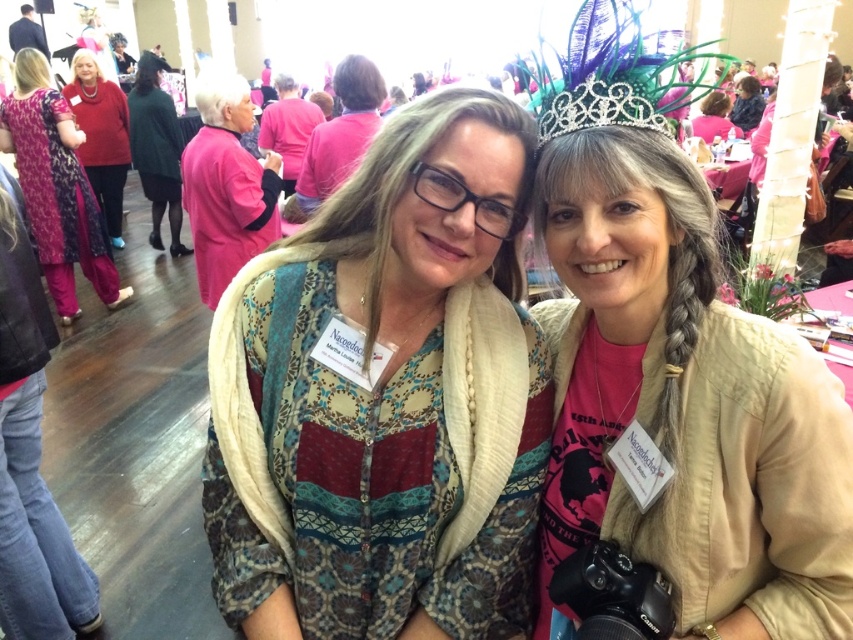
Who is higher up, pink fabric at center or clear crystal tiara at upper center?

Positioned higher is clear crystal tiara at upper center.

Does pink fabric at center appear on the right side of clear crystal tiara at upper center?

Yes, pink fabric at center is to the right of clear crystal tiara at upper center.

Locate an element on the screen. This screenshot has height=640, width=853. pink fabric at center is located at coordinates (683, 403).

Is matte pink blouse at center smaller than green wool sweater at upper left?

Correct, matte pink blouse at center occupies less space than green wool sweater at upper left.

Is point (294, 211) closer to viewer compared to point (164, 180)?

That is True.

You are a GUI agent. You are given a task and a screenshot of the screen. Output one action in this format:
    pyautogui.click(x=<x>, y=<y>)
    Task: Click on the matte pink blouse at center
    This screenshot has height=640, width=853.
    Given the screenshot: What is the action you would take?
    pyautogui.click(x=338, y=134)

Is pink fabric coat at upper left shorter than green wool sweater at upper left?

Yes.

Between pink fabric coat at upper left and green wool sweater at upper left, which one appears on the left side from the viewer's perspective?

green wool sweater at upper left is more to the left.

Who is more distant from viewer, (252, 237) or (157, 243)?

Point (157, 243)

Where is `pink fabric coat at upper left`? The image size is (853, 640). pink fabric coat at upper left is located at coordinates (225, 186).